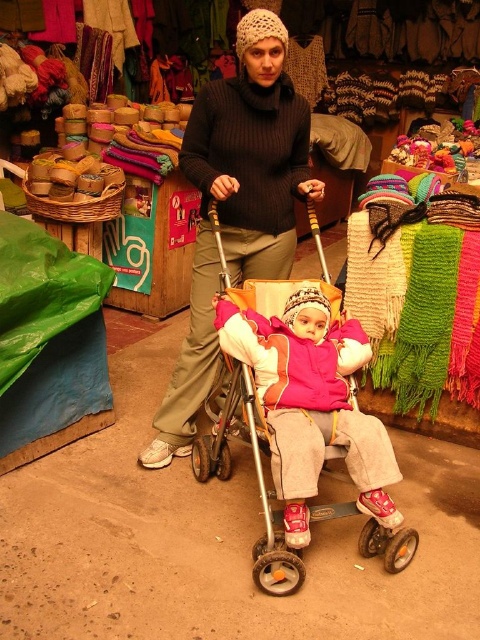
Between knitted woolen hat at center and pink fleece jacket at center, which one appears on the right side from the viewer's perspective?

pink fleece jacket at center

The image size is (480, 640). What do you see at coordinates (237, 204) in the screenshot?
I see `knitted woolen hat at center` at bounding box center [237, 204].

At what (x,y) coordinates should I click in order to perform the action: click on knitted woolen hat at center. Please return your answer as a coordinate pair (x, y). Looking at the image, I should click on (237, 204).